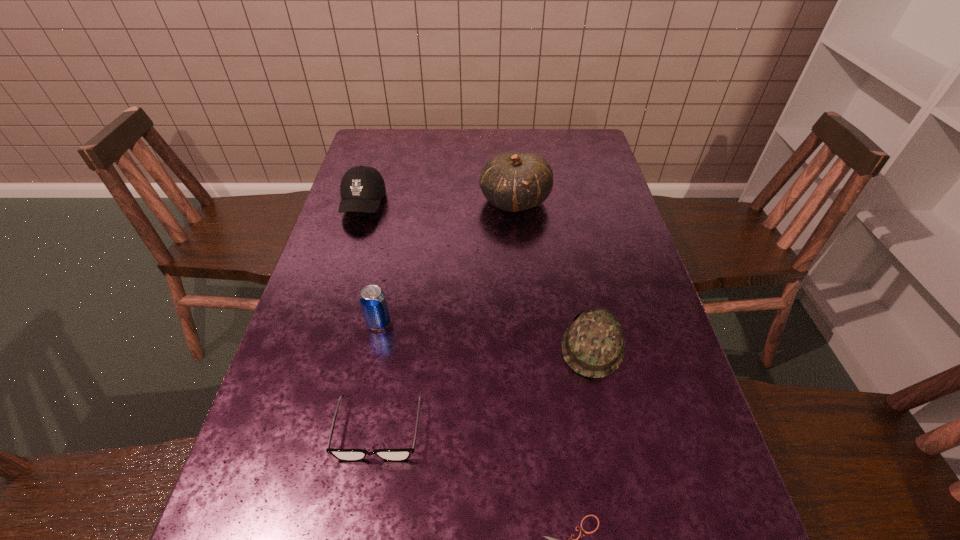
Where is `free space between the gourd and the leftmost object`? The image size is (960, 540). free space between the gourd and the leftmost object is located at coordinates (439, 202).

The image size is (960, 540). Identify the location of empty location between the baseball cap and the headwear. (478, 275).

This screenshot has width=960, height=540. Identify the location of vacant point located between the gourd and the spectacles. (446, 315).

Identify the location of vacant point located between the second nearest object and the beer can. This screenshot has height=540, width=960. (378, 376).

You are a GUI agent. You are given a task and a screenshot of the screen. Output one action in this format:
    pyautogui.click(x=<x>, y=<y>)
    Task: Click on the vacant point located between the headwear and the gourd
    The width and height of the screenshot is (960, 540).
    Given the screenshot: What is the action you would take?
    pyautogui.click(x=554, y=274)

You are a GUI agent. You are given a task and a screenshot of the screen. Output one action in this format:
    pyautogui.click(x=<x>, y=<y>)
    Task: Click on the blank region between the third shortest object and the gourd
    
    Given the screenshot: What is the action you would take?
    pyautogui.click(x=554, y=274)

Locate an element on the screen. object identified as the second closest to the beer can is located at coordinates (362, 187).

Identify which object is located as the fourth nearest to the gourd. Please provide its 2D coordinates. Your answer should be formatted as a tuple, i.e. [(x, y)], where the tuple contains the x and y coordinates of a point satisfying the conditions above.

[(349, 455)]

Locate an element on the screen. The image size is (960, 540). vacant space that satisfies the following two spatial constraints: 1. on the front-facing side of the leftmost object; 2. on the left side of the third shortest object is located at coordinates click(320, 347).